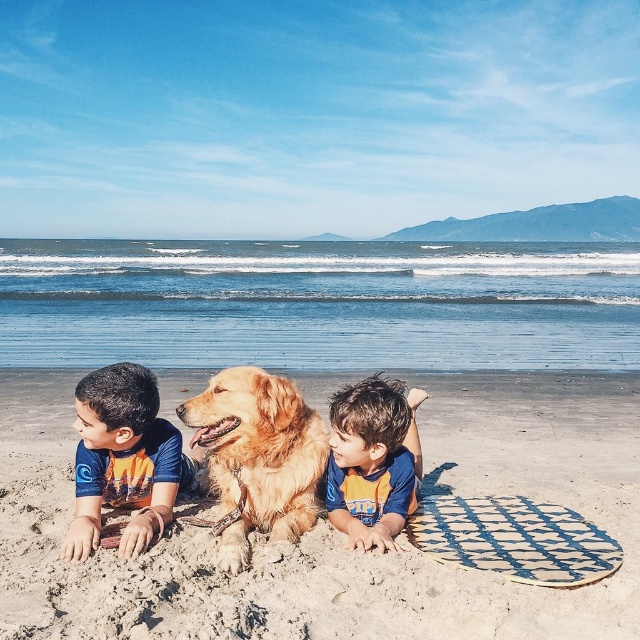
Between point (144, 596) and point (356, 422), which one is positioned in front?

Point (144, 596) is in front.

Is point (440, 598) behind point (371, 518)?

No, it is in front of (371, 518).

Image resolution: width=640 pixels, height=640 pixels. I want to click on golden sand at center, so click(333, 531).

Does golden fur dog at center appear on the right side of blue fabric boy at center?

Indeed, golden fur dog at center is positioned on the right side of blue fabric boy at center.

Which is behind, point (298, 502) or point (136, 548)?

Point (298, 502)

Image resolution: width=640 pixels, height=640 pixels. Find the location of `golden fur dog at center`. golden fur dog at center is located at coordinates (257, 456).

Can you confirm if golden fur dog at center is thinner than blue and orange swimsuit at center?

No, golden fur dog at center is not thinner than blue and orange swimsuit at center.

Does golden fur dog at center appear on the right side of blue and orange swimsuit at center?

Incorrect, golden fur dog at center is not on the right side of blue and orange swimsuit at center.

Who is more forward, (285,540) or (356,426)?

Point (356,426) is in front.

The image size is (640, 640). What are the coordinates of `golden fur dog at center` in the screenshot? It's located at (257, 456).